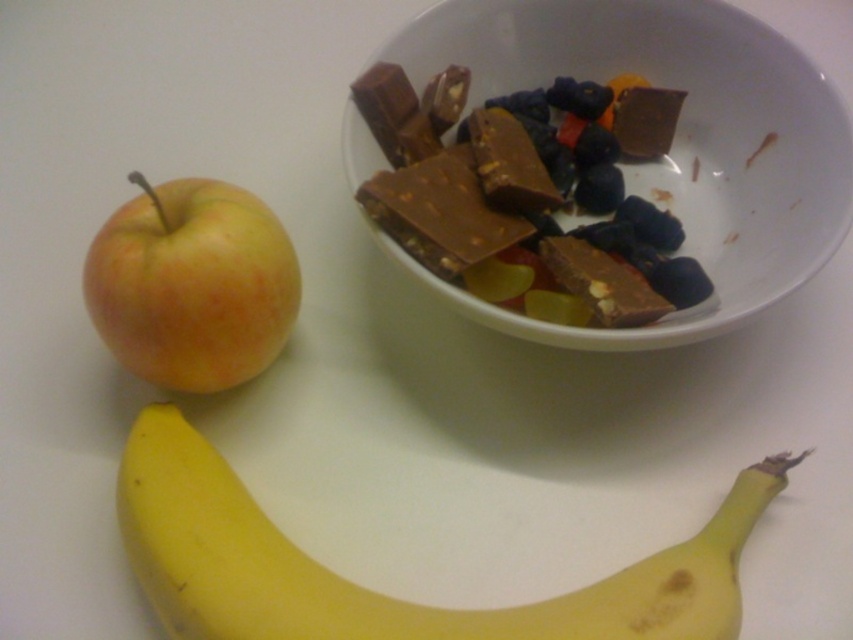
Can you confirm if dark chocolate bar at upper center is bigger than dark chocolate bar at center?

Yes, dark chocolate bar at upper center is bigger than dark chocolate bar at center.

Who is shorter, dark chocolate bar at upper center or dark chocolate bar at center?

With less height is dark chocolate bar at center.

Does point (442, 202) come farther from viewer compared to point (575, 284)?

Yes, it is.

What are the coordinates of `dark chocolate bar at upper center` in the screenshot? It's located at (440, 212).

Is white ceramic bowl at upper center bigger than dark chocolate bar at center?

Yes, white ceramic bowl at upper center is bigger than dark chocolate bar at center.

Is white ceramic bowl at upper center wider than dark chocolate bar at center?

Yes.

Measure the distance between point (666, 342) and camera.

Point (666, 342) is 1.10 meters from camera.

At what (x,y) coordinates should I click in order to perform the action: click on white ceramic bowl at upper center. Please return your answer as a coordinate pair (x, y). The image size is (853, 640). Looking at the image, I should click on (672, 144).

Between yellow matte apple at left and dark chocolate bar at center, which one is positioned higher?

Positioned higher is dark chocolate bar at center.

Does yellow matte apple at left appear on the left side of dark chocolate bar at center?

Correct, you'll find yellow matte apple at left to the left of dark chocolate bar at center.

Which is in front, point (209, 266) or point (637, 308)?

Point (209, 266)

At what (x,y) coordinates should I click in order to perform the action: click on yellow matte apple at left. Please return your answer as a coordinate pair (x, y). Looking at the image, I should click on (192, 284).